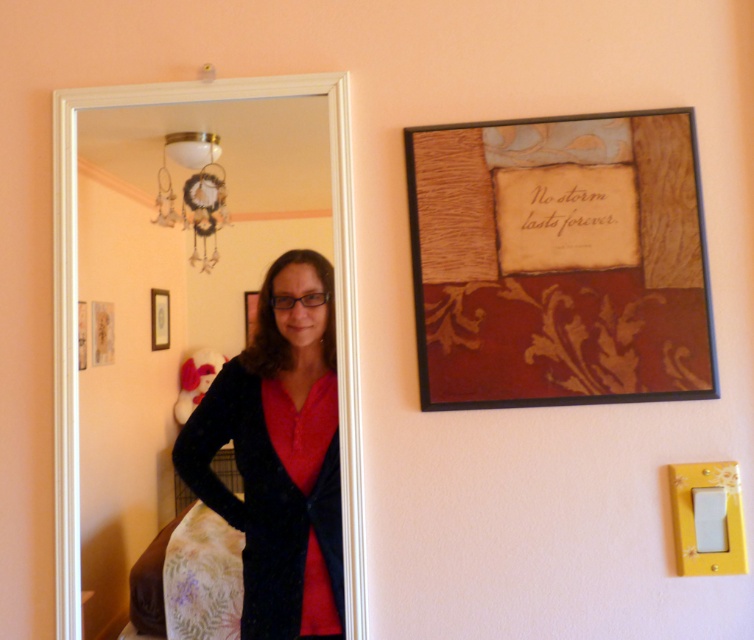
You are standing in the room and want to locate the wooden plaque at upper right. According to the coordinates given, where should you look relative to the artwork?

The wooden plaque at upper right is located at coordinates point (559, 260), which places it to the right side of the artwork.

You are standing in the room and want to hang a new painting. The wooden picture frame at center and the matte black picture frame at center are already on the wall. Which frame is covering part of the other?

The wooden picture frame at center is positioned over matte black picture frame at center, so it is covering part of the matte black picture frame at center.